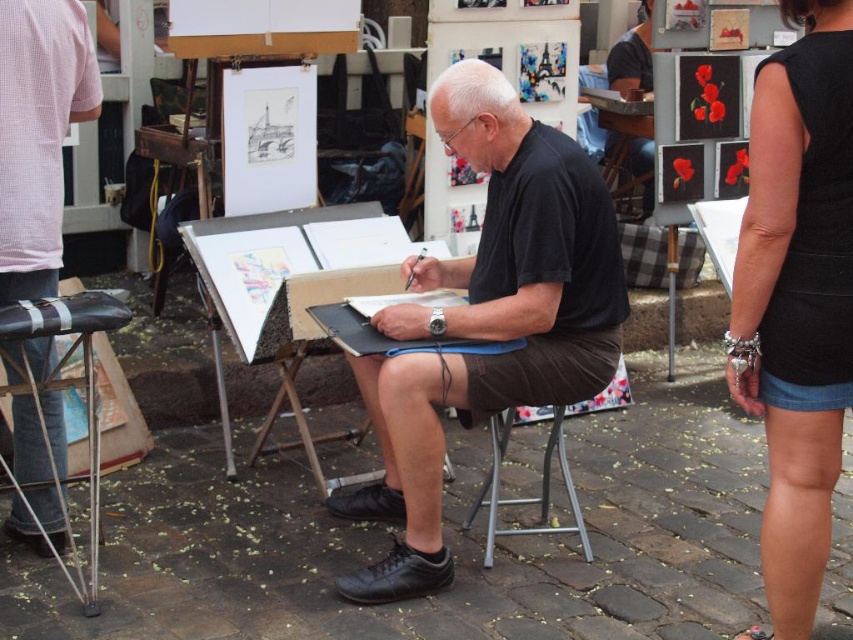
Question: Among these objects, which one is nearest to the camera?

Choices:
 (A) wooden easel at center
 (B) black matte dress at center
 (C) matte black shirt at center

Answer: (B)

Question: Is matte black shirt at center above wooden easel at center?

Choices:
 (A) no
 (B) yes

Answer: (B)

Question: Does black matte dress at center appear on the right side of wooden easel at center?

Choices:
 (A) no
 (B) yes

Answer: (B)

Question: Which object appears closest to the camera in this image?

Choices:
 (A) black matte dress at center
 (B) matte black shirt at center
 (C) wooden easel at center

Answer: (A)

Question: Which of these objects is positioned closest to the black matte shirt at center?

Choices:
 (A) black matte dress at center
 (B) matte black shirt at center
 (C) wooden easel at center

Answer: (C)

Question: Is black matte shirt at center to the left of wooden easel at center from the viewer's perspective?

Choices:
 (A) no
 (B) yes

Answer: (A)